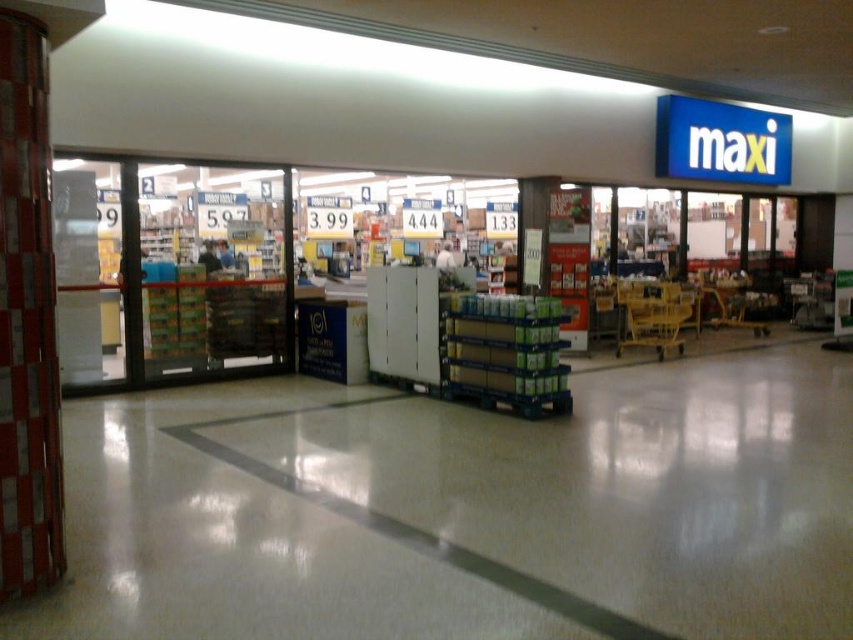
Question: Is white plastic shelves at center to the right of yellow plastic shopping cart at center from the viewer's perspective?

Choices:
 (A) no
 (B) yes

Answer: (A)

Question: Does white plastic shelves at center appear over yellow plastic shopping cart at center?

Choices:
 (A) no
 (B) yes

Answer: (B)

Question: Is white plastic shelves at center below yellow plastic shopping cart at center?

Choices:
 (A) no
 (B) yes

Answer: (A)

Question: Which point is farther to the camera?

Choices:
 (A) white plastic shelves at center
 (B) yellow plastic shopping cart at center

Answer: (B)